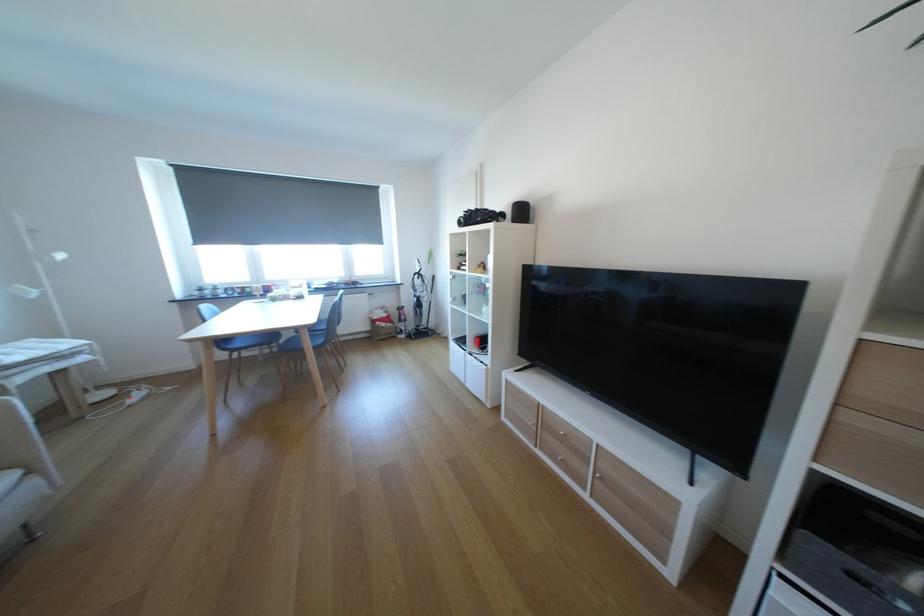
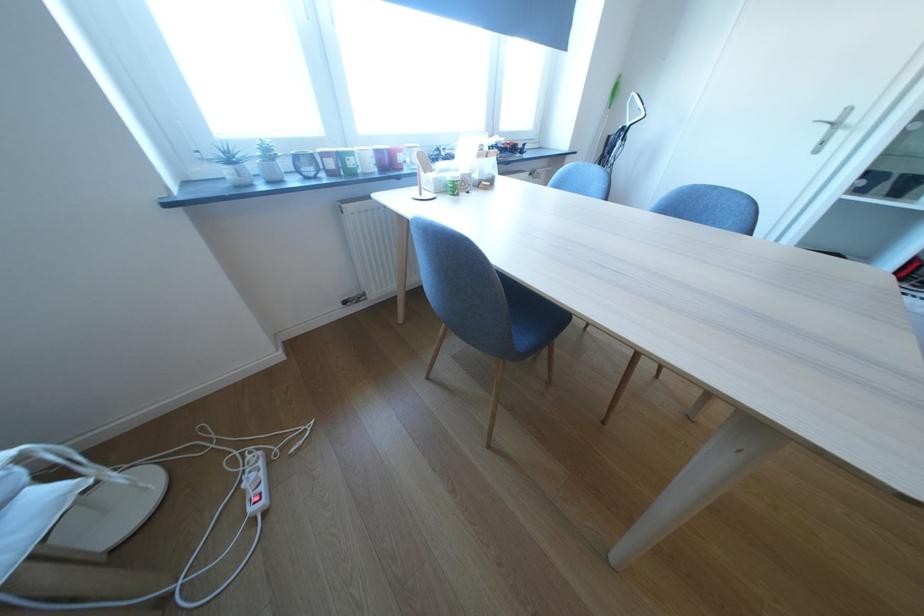
Find the pixel in the second image that matches point 259,292 in the first image.

(361, 164)